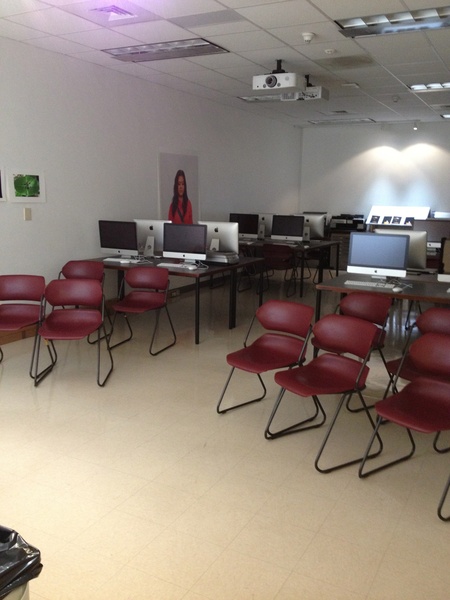
The height and width of the screenshot is (600, 450). Identify the location of keyboard. (357, 284).